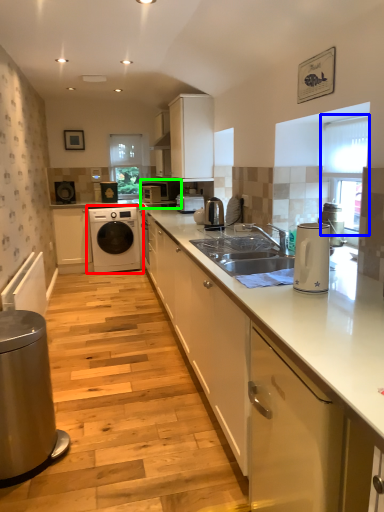
Question: Considering the real-world distances, which object is farthest from washing machine (highlighted by a red box)? window screen (highlighted by a blue box) or home appliance (highlighted by a green box)?

Choices:
 (A) window screen
 (B) home appliance

Answer: (A)